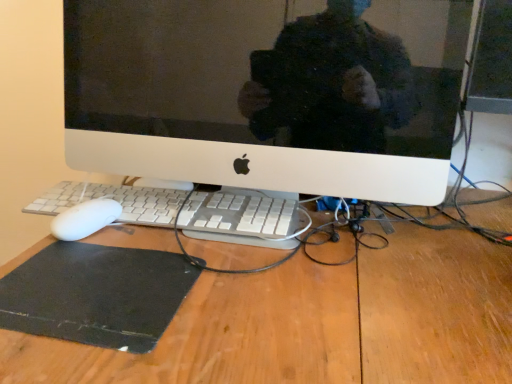
This screenshot has width=512, height=384. What are the coordinates of `empty space that is ontop of black rubber mousepad at lower left` in the screenshot? It's located at (79, 276).